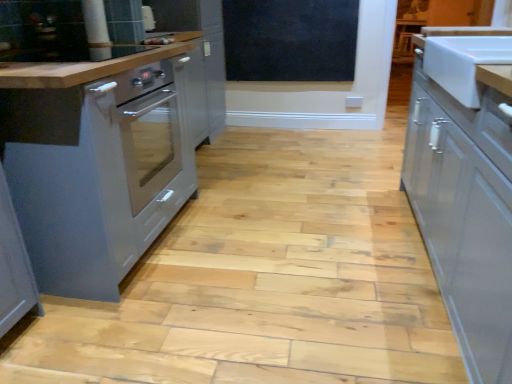
Question: Looking at the image, does black matte chalkboard at upper center seem bigger or smaller compared to white glossy sink at right?

Choices:
 (A) big
 (B) small

Answer: (B)

Question: Does point (349, 16) appear closer or farther from the camera than point (446, 79)?

Choices:
 (A) farther
 (B) closer

Answer: (A)

Question: Which object is positioned farthest from the black matte chalkboard at upper center?

Choices:
 (A) white glossy sink at right
 (B) satin grey cabinet at left, which is the 2th cabinetry from right to left
 (C) white glossy cabinet at right, placed as the 1th cabinetry when sorted from right to left

Answer: (C)

Question: Based on their relative distances, which object is nearer to the black matte chalkboard at upper center?

Choices:
 (A) white glossy cabinet at right, arranged as the second cabinetry when viewed from the left
 (B) satin grey cabinet at left, the first cabinetry in the left-to-right sequence
 (C) white glossy sink at right

Answer: (B)